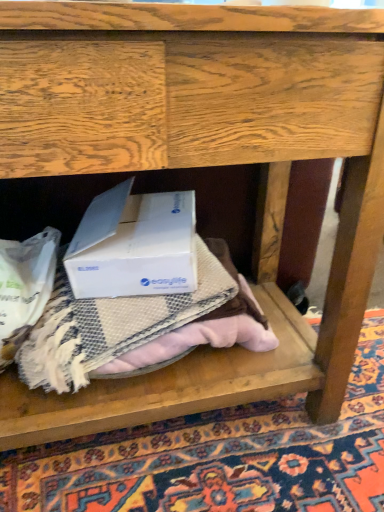
Identify the location of white cardboard box at center. (134, 246).

Find the location of a particular element. Image resolution: width=384 pixels, height=512 pixels. beige textured mat at center is located at coordinates (221, 457).

Which of these two, beige textured blanket at center or white cardboard box at center, is smaller?

Smaller between the two is beige textured blanket at center.

This screenshot has height=512, width=384. What are the coordinates of `clothing located underneath the white cardboard box at center (from a real-world perspective)` in the screenshot? It's located at (201, 330).

Is beige textured blanket at center not inside white cardboard box at center?

Yes, beige textured blanket at center is not within white cardboard box at center.

Is point (225, 335) positioned before point (111, 258)?

No, (225, 335) is further to viewer.

In the scene shown: Between beige textured mat at center and white cardboard box at center, which one has smaller size?

With smaller size is white cardboard box at center.

Could you tell me if beige textured mat at center is turned towards white cardboard box at center?

No, beige textured mat at center is not facing towards white cardboard box at center.

Is point (326, 486) closer to viewer compared to point (127, 204)?

Yes, it is.

How far apart are beige textured mat at center and white cardboard box at center?

beige textured mat at center is 43.42 centimeters from white cardboard box at center.

Which point is more forward, (120, 200) or (147, 367)?

The point (147, 367) is closer.

Does white cardboard box at center have a lesser height compared to beige textured blanket at center?

Incorrect, the height of white cardboard box at center does not fall short of that of beige textured blanket at center.

Does white cardboard box at center turn towards beige textured blanket at center?

No, white cardboard box at center is not turned towards beige textured blanket at center.

Is beige textured mat at center taller or shorter than beige textured blanket at center?

Clearly, beige textured mat at center is shorter compared to beige textured blanket at center.

Is beige textured mat at center with beige textured blanket at center?

beige textured mat at center and beige textured blanket at center are clearly separated.

Based on their positions, is beige textured mat at center located to the left or right of beige textured blanket at center?

beige textured mat at center is to the right of beige textured blanket at center.

Is beige textured mat at center facing towards beige textured blanket at center?

No, beige textured mat at center is not facing towards beige textured blanket at center.

At what (x,y) coordinates should I click in order to perform the action: click on clothing above the beige textured mat at center (from a real-world perspective). Please return your answer as a coordinate pair (x, y). This screenshot has height=512, width=384. Looking at the image, I should click on (201, 330).

Is beige textured blanket at center positioned with its back to beige textured mat at center?

No.

In terms of width, does beige textured blanket at center look wider or thinner when compared to beige textured mat at center?

Clearly, beige textured blanket at center has less width compared to beige textured mat at center.

Who is shorter, beige textured blanket at center or beige textured mat at center?

Standing shorter between the two is beige textured mat at center.

Is white cardboard box at center beside beige textured mat at center?

No, white cardboard box at center is not with beige textured mat at center.

Is white cardboard box at center oriented away from beige textured mat at center?

No, white cardboard box at center is not facing the opposite direction of beige textured mat at center.

Considering the sizes of white cardboard box at center and beige textured mat at center in the image, is white cardboard box at center wider or thinner than beige textured mat at center?

white cardboard box at center is thinner than beige textured mat at center.

Where is `mat in front of the white cardboard box at center`? mat in front of the white cardboard box at center is located at coordinates (221, 457).

Find the location of a particular element. The height and width of the screenshot is (512, 384). clothing on the right of white cardboard box at center is located at coordinates (201, 330).

The height and width of the screenshot is (512, 384). Identify the location of box on the left side of beige textured mat at center. (134, 246).

Based on their spatial positions, is beige textured mat at center or beige textured blanket at center further from white cardboard box at center?

beige textured mat at center is further to white cardboard box at center.

Based on their spatial positions, is beige textured mat at center or white cardboard box at center further from beige textured blanket at center?

beige textured mat at center is positioned further to the anchor beige textured blanket at center.

Based on their spatial positions, is white cardboard box at center or beige textured blanket at center closer to beige textured mat at center?

beige textured blanket at center lies closer to beige textured mat at center than the other object.

Which object lies further to the anchor point beige textured mat at center, beige textured blanket at center or white cardboard box at center?

white cardboard box at center is positioned further to the anchor beige textured mat at center.

Considering their positions, is beige textured blanket at center positioned further to white cardboard box at center than beige textured mat at center?

beige textured mat at center is further to white cardboard box at center.

Looking at the image, which one is located closer to beige textured blanket at center, white cardboard box at center or beige textured mat at center?

white cardboard box at center.

At what (x,y) coordinates should I click in order to perform the action: click on clothing located between white cardboard box at center and beige textured mat at center in the left-right direction. Please return your answer as a coordinate pair (x, y). The width and height of the screenshot is (384, 512). Looking at the image, I should click on (201, 330).